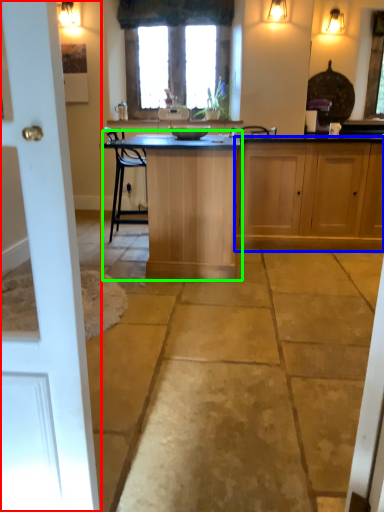
Question: Estimate the real-world distances between objects in this image. Which object is farther from door (highlighted by a red box), cabinetry (highlighted by a blue box) or table (highlighted by a green box)?

Choices:
 (A) cabinetry
 (B) table

Answer: (A)